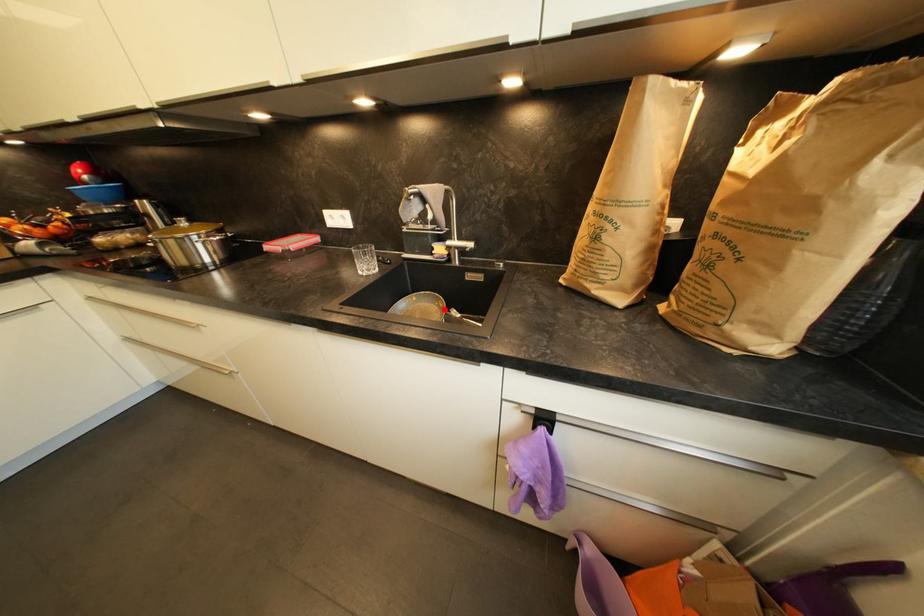
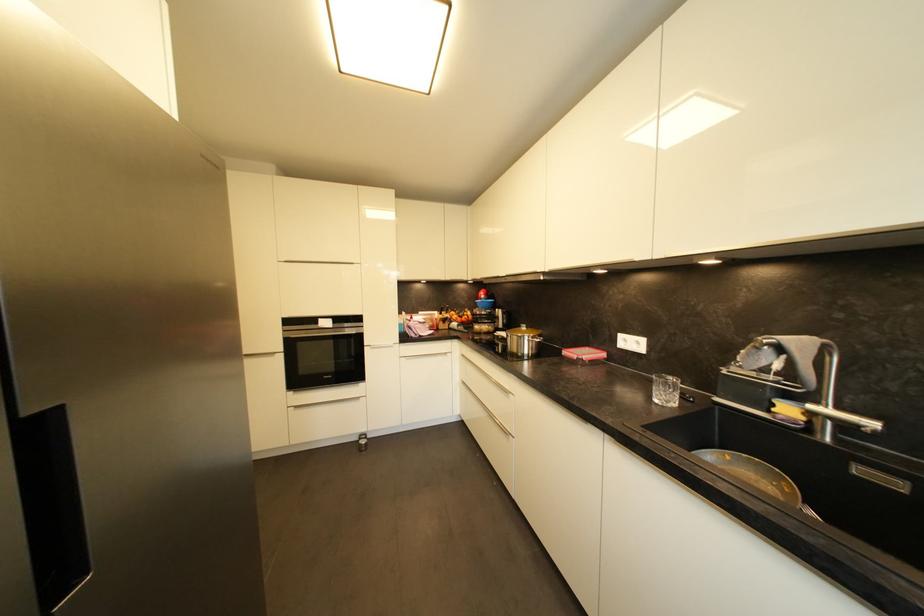
Question: I am providing you with two images of the same scene from different viewpoints. Image1 has a red point marked. In image2, the corresponding 3D location appears at what relative position? Reply with the corresponding letter.

Choices:
 (A) Closer
 (B) Farther

Answer: (B)